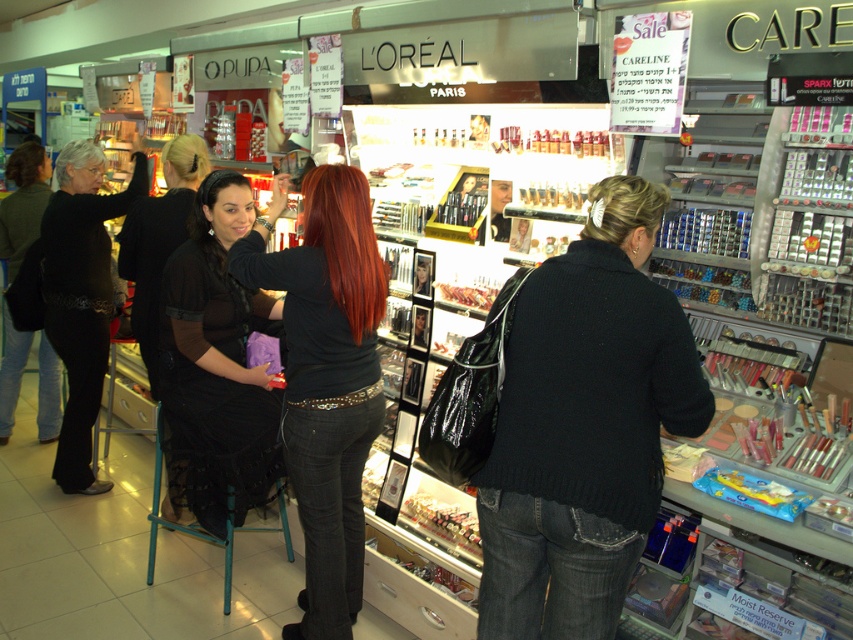
Question: Which point appears farthest from the camera in this image?

Choices:
 (A) (61, 152)
 (B) (24, 179)
 (C) (248, 186)

Answer: (B)

Question: Which of the following is the farthest from the observer?

Choices:
 (A) black lace belt at left
 (B) shiny orange hair at center

Answer: (A)

Question: Is black lace belt at left positioned in front of blonde hair at upper center?

Choices:
 (A) yes
 (B) no

Answer: (B)

Question: Is black lace dress at left below matte black jacket at left?

Choices:
 (A) no
 (B) yes

Answer: (A)

Question: Which point appears farthest from the camera in this image?

Choices:
 (A) click(367, 332)
 (B) click(262, 420)
 (C) click(604, 602)
 (D) click(6, 170)

Answer: (D)

Question: From the image, what is the correct spatial relationship of matte black shirt at center in relation to blonde hair at upper center?

Choices:
 (A) above
 (B) below

Answer: (B)